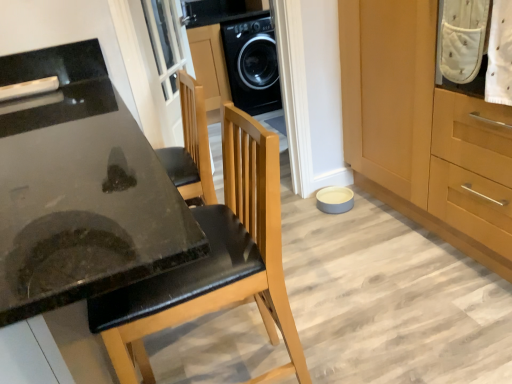
Question: In the image, is white dotted fabric at upper right positioned in front of or behind black glossy countertop at lower left?

Choices:
 (A) behind
 (B) front

Answer: (A)

Question: Based on their sizes in the image, would you say white dotted fabric at upper right is bigger or smaller than black glossy countertop at lower left?

Choices:
 (A) small
 (B) big

Answer: (A)

Question: Which is farther from the wooden cabinet at lower right?

Choices:
 (A) white glass screen door at upper center
 (B) white dotted fabric at upper right
 (C) black glossy countertop at lower left
 (D) black glossy washing machine at center
 (E) black leather chair at center

Answer: (D)

Question: Which is farther from the black glossy countertop at lower left?

Choices:
 (A) black glossy washing machine at center
 (B) white glass screen door at upper center
 (C) black leather chair at center
 (D) white dotted fabric at upper right
 (E) wooden cabinet at lower right

Answer: (A)